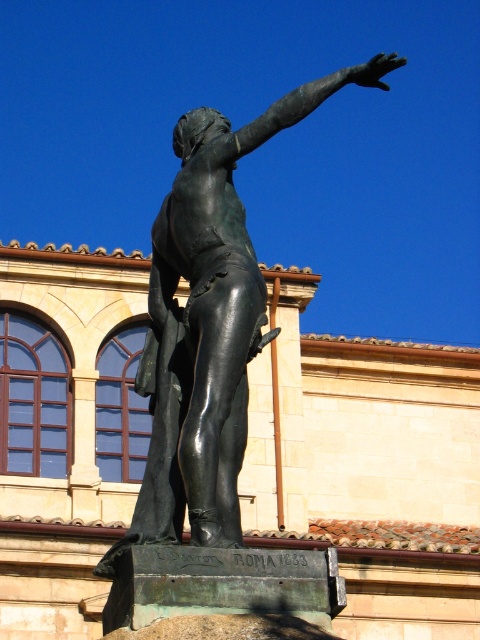
Can you confirm if shiny bronze statue at center is thinner than bronze arm at upper right?

Indeed, shiny bronze statue at center has a lesser width compared to bronze arm at upper right.

Can you confirm if shiny bronze statue at center is smaller than bronze arm at upper right?

Correct, shiny bronze statue at center occupies less space than bronze arm at upper right.

In order to click on shiny bronze statue at center in this screenshot , I will do `click(207, 324)`.

Where is `shiny bronze statue at center`? The image size is (480, 640). shiny bronze statue at center is located at coordinates (x=207, y=324).